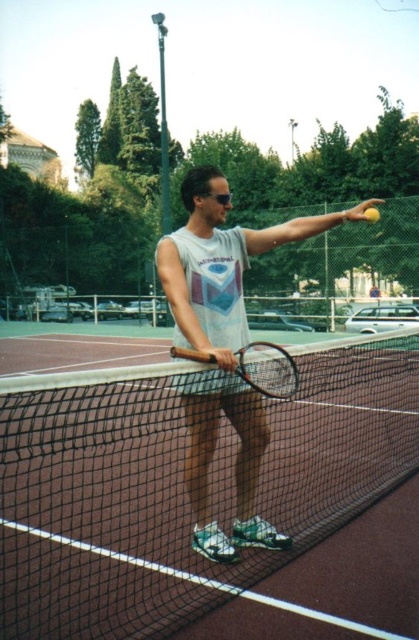
Question: Which object is farther from the camera taking this photo?

Choices:
 (A) matte black tennis racket at center
 (B) black mesh net at center

Answer: (B)

Question: Does black mesh net at center appear on the left side of matte black tennis racket at center?

Choices:
 (A) yes
 (B) no

Answer: (A)

Question: Considering the relative positions of black mesh net at center and matte black tennis racket at center in the image provided, where is black mesh net at center located with respect to matte black tennis racket at center?

Choices:
 (A) right
 (B) left

Answer: (B)

Question: Can you confirm if white cotton tank top at center is positioned above matte black tennis racket at center?

Choices:
 (A) no
 (B) yes

Answer: (A)

Question: Which point is closer to the camera taking this photo?

Choices:
 (A) (276, 348)
 (B) (183, 342)

Answer: (A)

Question: Among these objects, which one is nearest to the camera?

Choices:
 (A) black mesh net at center
 (B) matte black tennis racket at center

Answer: (B)